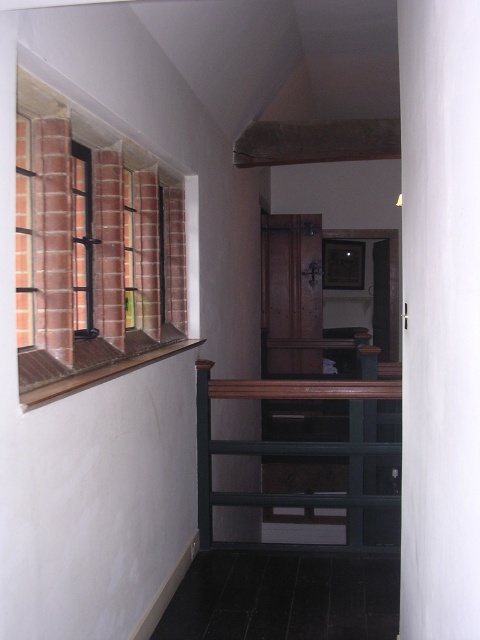
You are a painter who needs to place a 30 cm wide ladder between the brick textured window at upper left and the brick textured window at left. Can you fit the ladder in the space between them?

The distance between the brick textured window at upper left and the brick textured window at left is 22.93 centimeters, which is shorter than the ladder width of 30 cm. Therefore, the ladder cannot fit in the space between them.